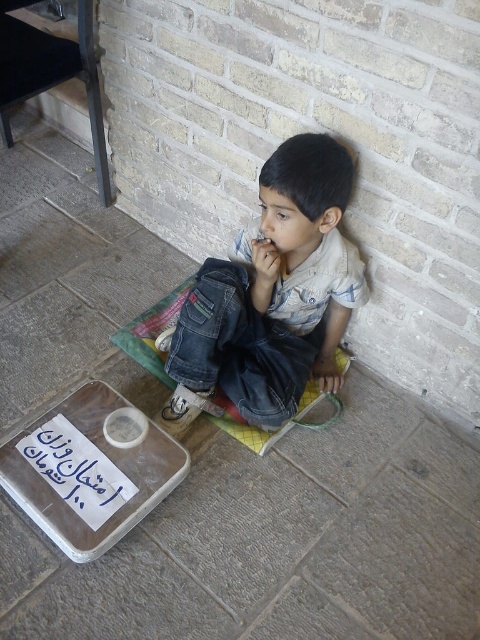
You are organizing a picnic and have a transparent plastic tray at lower left and a green woven mat at center. Which item takes up more area on the floor?

The green woven mat at center takes up more area than the transparent plastic tray at lower left because the transparent plastic tray at lower left occupies less space than green woven mat at center.

You are a photographer setting up a shoot. You need to position a light source so that it illuminates both the denim jeans at center and the transparent plastic tray at lower left equally. Based on their positions, where should you place the light source relative to the two objects?

Since the denim jeans at center is to the right of the transparent plastic tray at lower left, placing the light source directly in between them, equidistant from both, would ensure equal illumination. Alternatively, positioning it centrally above them would also work.